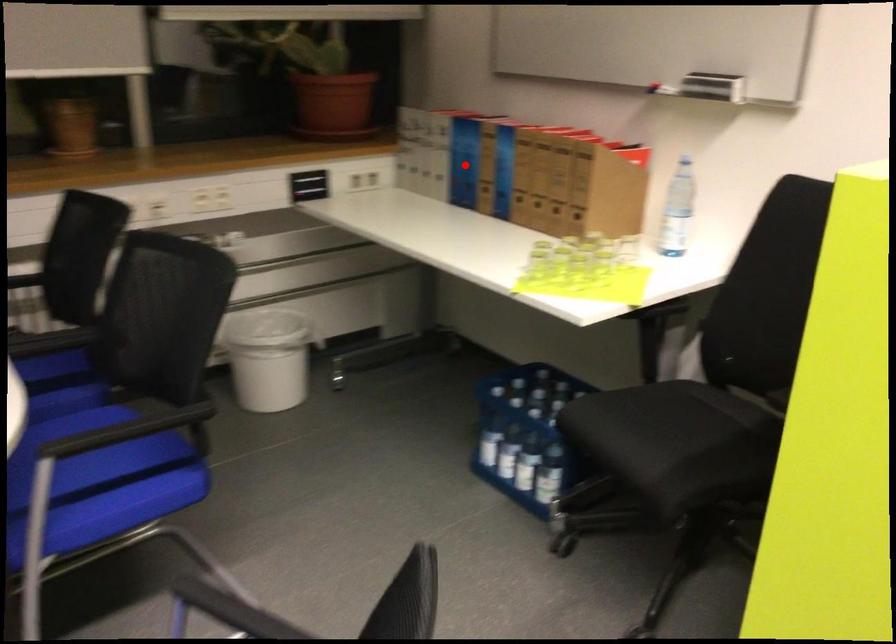
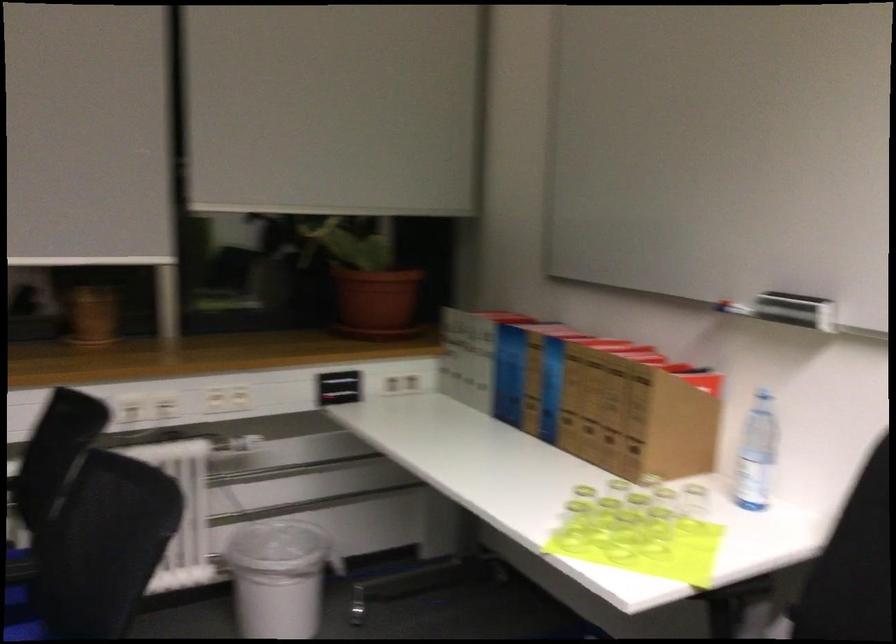
Question: I am providing you with two images of the same scene from different viewpoints. Image1 has a red point marked. In image2, the corresponding 3D location appears at what relative position? Reply with the corresponding letter.

Choices:
 (A) Closer
 (B) Farther

Answer: (A)